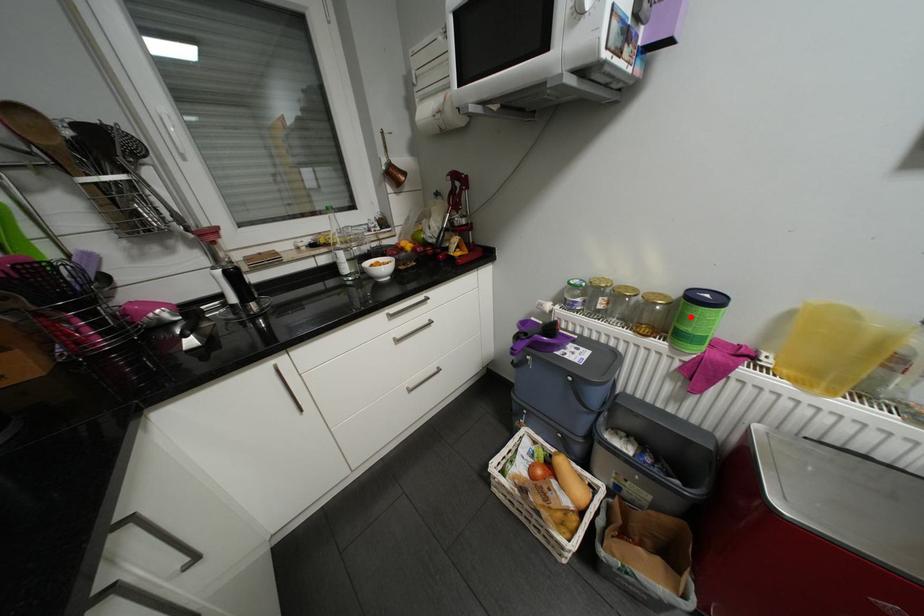
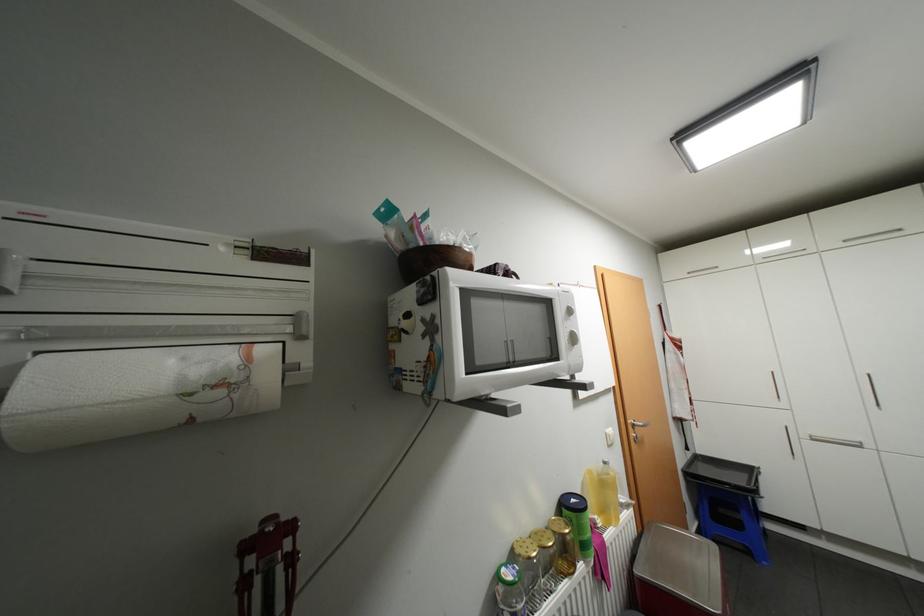
Where in the second image is the point corresponding to the highlighted location from the first image?

(589, 528)